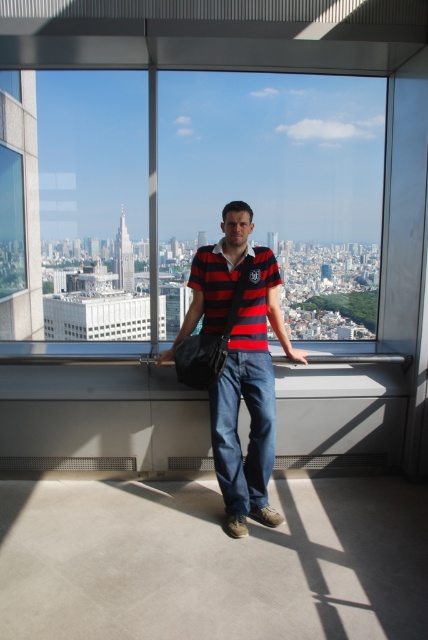
Looking at this image, you are a photographer setting up a shot of the city view through the window. You have a gray concrete ledge at center and a striped cotton shirt at center in the frame. Which object would you need to adjust to avoid blocking the city view, and why?

A: The striped cotton shirt at center is larger than the gray concrete ledge at center, so adjusting the striped cotton shirt at center would be necessary to prevent it from blocking more of the city view.

You are an interior designer planning to install a new lighting fixture. You need to determine which object, the transparent glass window at center or the gray concrete ledge at center, has enough vertical space to accommodate a 2.5 meter tall light fixture. Based on the scene, which one is suitable?

The transparent glass window at center has a greater height compared to the gray concrete ledge at center, so the transparent glass window at center is suitable for the 2.5 meter tall light fixture.

You are a photographer trying to capture a closeup of the striped cotton shirt at center while ensuring the gray concrete ledge at center is still visible in the frame. Given the distance between them, will you need to adjust your camera settings to focus on both objects simultaneously?

The gray concrete ledge at center is 27.86 inches away from the striped cotton shirt at center. Since this distance is relatively small, you can adjust your camera to a narrower aperture to increase the depth of field, allowing both the striped cotton shirt at center and the gray concrete ledge at center to be in focus.